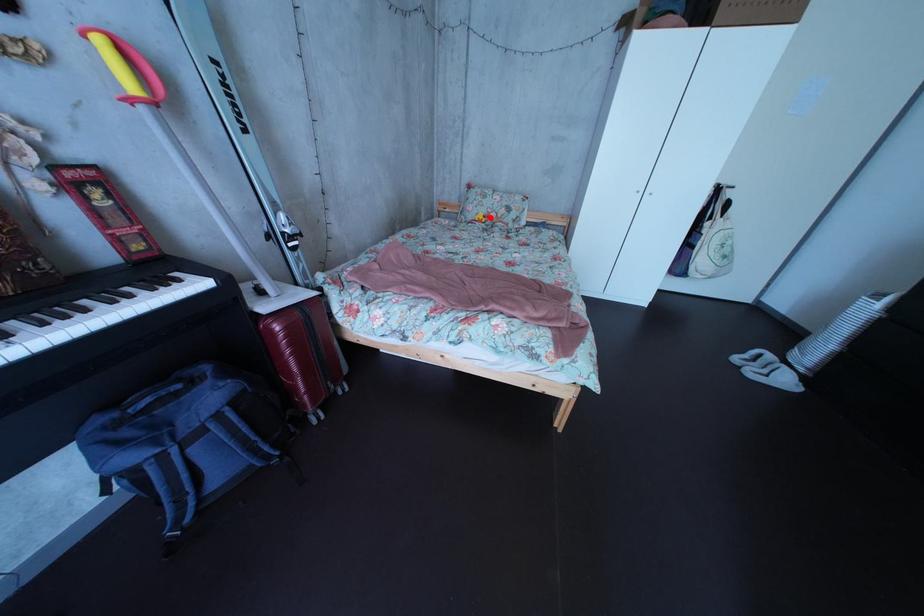
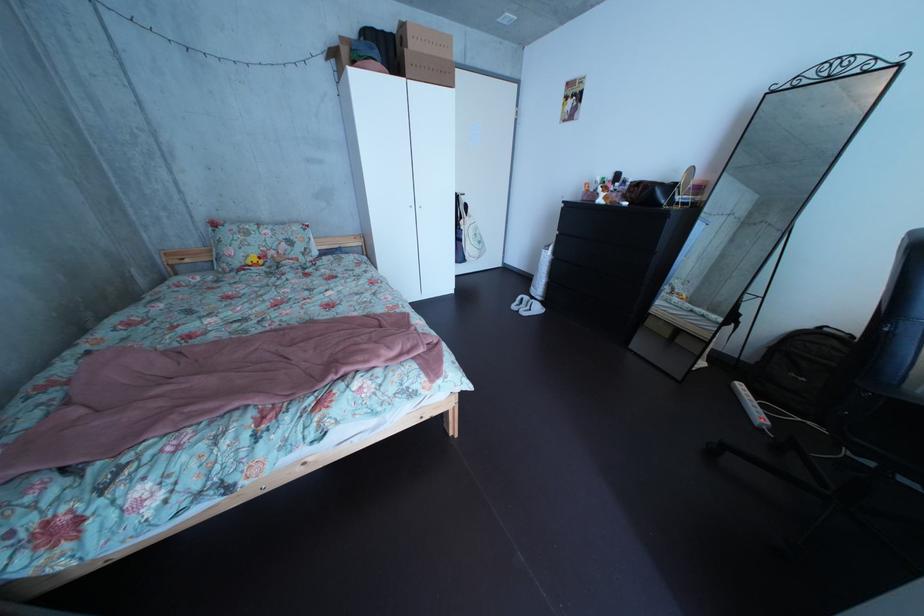
The point at the highlighted location is marked in the first image. Where is the corresponding point in the second image?

(256, 260)